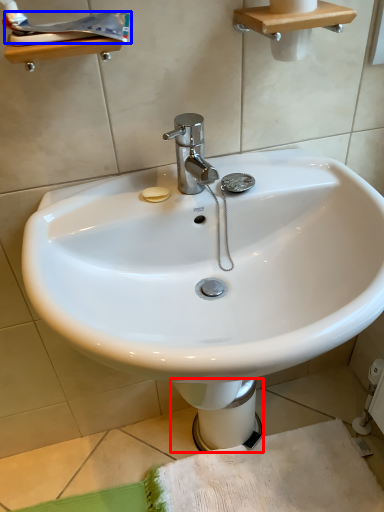
Question: Which object is further to the camera taking this photo, bidet (highlighted by a red box) or toothpaste (highlighted by a blue box)?

Choices:
 (A) bidet
 (B) toothpaste

Answer: (A)